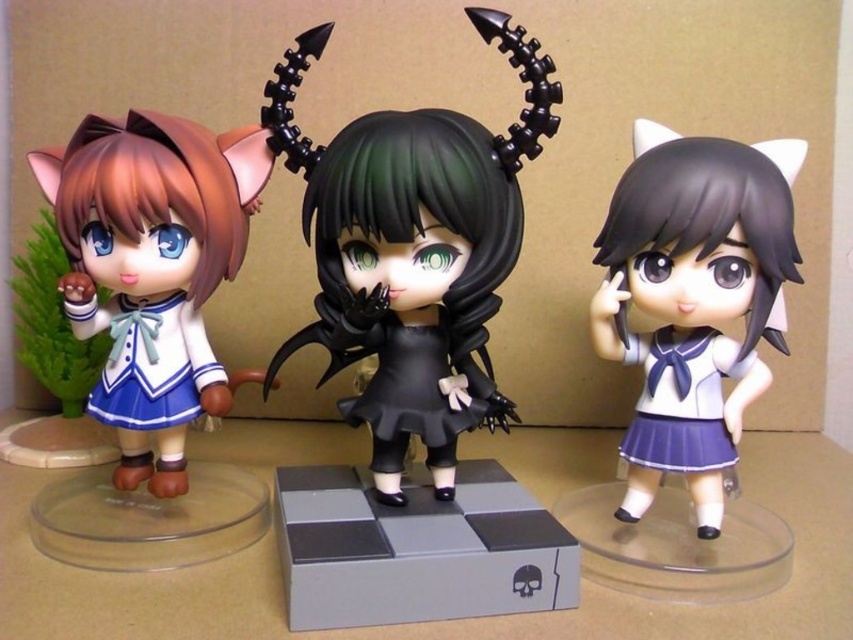
Which object is located at the coordinates point (x=152, y=269)?

The point (x=152, y=269) corresponds to the matte blue fabric dress at left.

You are organizing a school uniform display and need to arrange the satin blue school uniform at left and the black matte school uniform at center. According to the image, which uniform is placed to the left of the other?

The satin blue school uniform at left is positioned on the left side of the black matte school uniform at center.